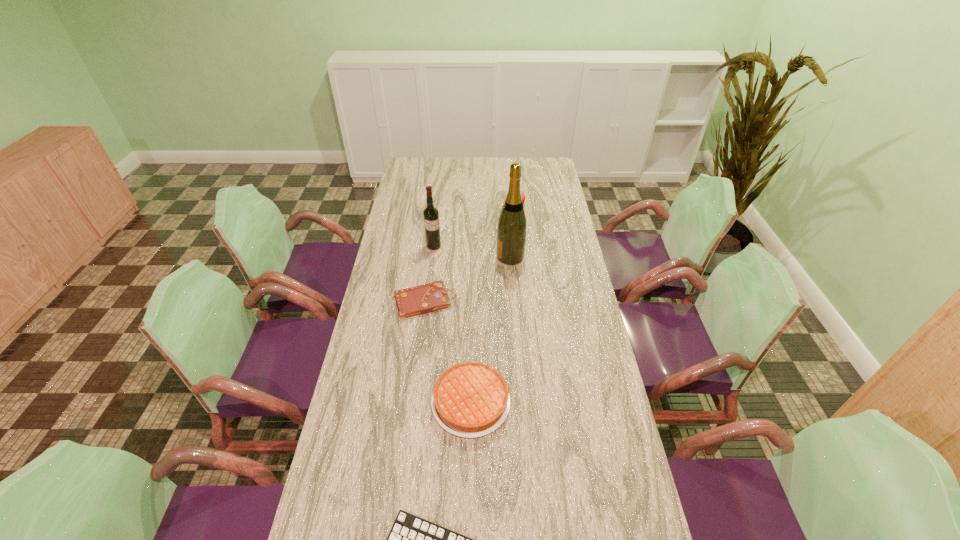
Locate an element on the screen. The width and height of the screenshot is (960, 540). vacant space at the far left corner of the desktop is located at coordinates (412, 170).

Where is `free spot between the notebook and the apple`? The width and height of the screenshot is (960, 540). free spot between the notebook and the apple is located at coordinates (470, 253).

Find the location of `unoccupied position between the taller wine bottle and the left wine bottle`. unoccupied position between the taller wine bottle and the left wine bottle is located at coordinates (472, 252).

Find the location of a particular element. The width and height of the screenshot is (960, 540). empty space between the left wine bottle and the third shortest object is located at coordinates (452, 325).

You are a GUI agent. You are given a task and a screenshot of the screen. Output one action in this format:
    pyautogui.click(x=<x>, y=<y>)
    Task: Click on the empty space that is in between the fourth tallest object and the farthest object
    The height and width of the screenshot is (540, 960).
    Given the screenshot: What is the action you would take?
    pyautogui.click(x=493, y=303)

Find the location of a particular element. This screenshot has height=540, width=960. free space between the taller wine bottle and the notebook is located at coordinates (468, 279).

Where is `vacant space that is in between the left wine bottle and the taller wine bottle`? This screenshot has width=960, height=540. vacant space that is in between the left wine bottle and the taller wine bottle is located at coordinates (472, 252).

Where is `object that stands as the fourth closest to the tallest object`? The height and width of the screenshot is (540, 960). object that stands as the fourth closest to the tallest object is located at coordinates click(470, 399).

Locate which object ranks fourth in proximity to the apple. Please provide its 2D coordinates. Your answer should be formatted as a tuple, i.e. [(x, y)], where the tuple contains the x and y coordinates of a point satisfying the conditions above.

[(470, 399)]

Where is `vacant space that satisfies the following two spatial constraints: 1. on the front and back of the shorter wine bottle; 2. on the left side of the second nearest object`? The height and width of the screenshot is (540, 960). vacant space that satisfies the following two spatial constraints: 1. on the front and back of the shorter wine bottle; 2. on the left side of the second nearest object is located at coordinates (415, 403).